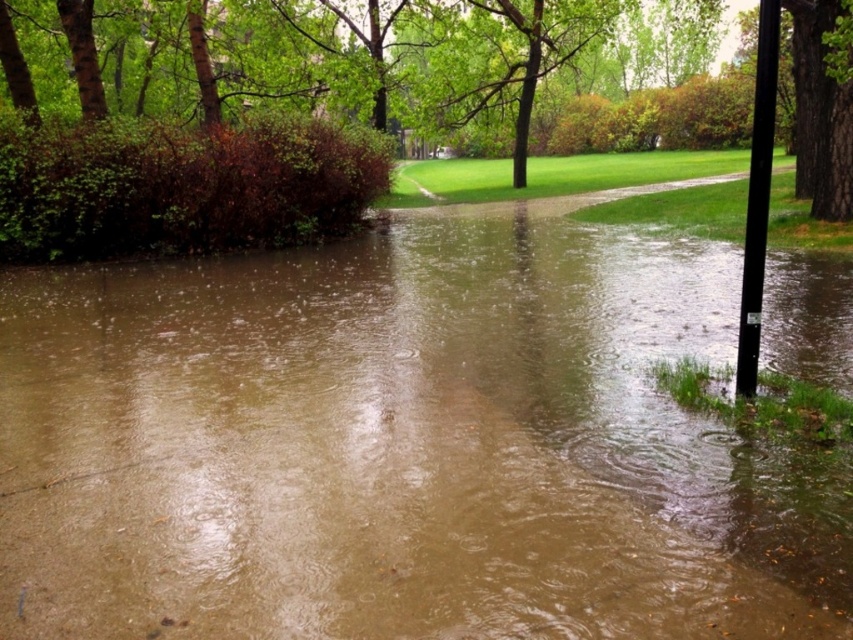
You are standing at the point marked by the coordinates point (378, 444) in the image. Based on the scene description, what is the primary substance you are standing on?

The primary substance you are standing on is brown muddy water at center, as the coordinates point (378, 444) corresponds to this location according to the objects description.

You are a pedestrian trying to cross the flooded pathway. You see the brown muddy water at center and the brown rough bark tree at upper right. Which object is closer to the left side of the path?

The brown muddy water at center is positioned on the left side of brown rough bark tree at upper right, so it is closer to the left side of the path.

You are a hiker trying to cross the flooded pathway. You see the brown muddy water at center and the black smooth pole at right. Which object takes up more space in the image?

The black smooth pole at right takes up more space in the image than the brown muddy water at center because the brown muddy water at center occupies less space than black smooth pole at right.